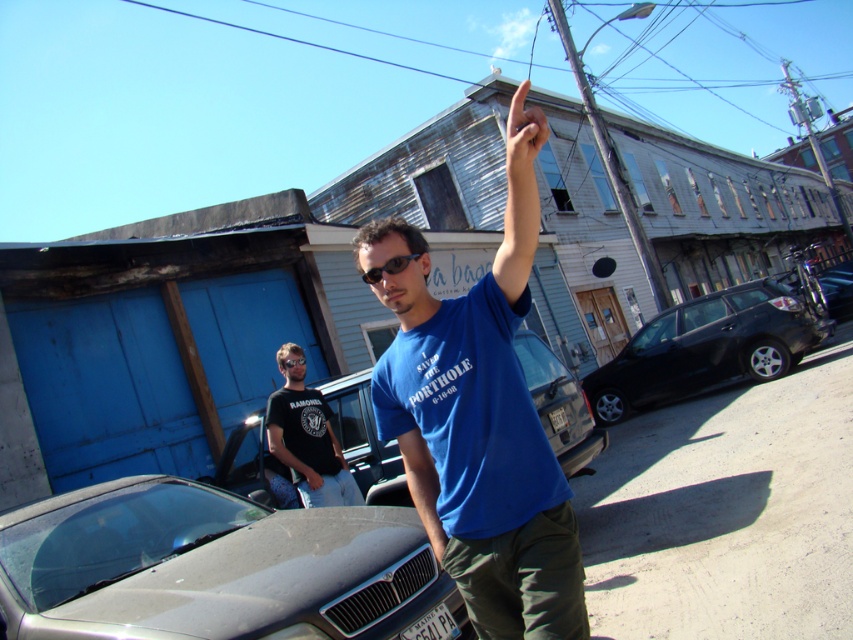
Question: Does silver metallic car at center have a greater width compared to black plastic sunglasses at center?

Choices:
 (A) no
 (B) yes

Answer: (B)

Question: Is metallic blue sedan at center to the left of matte skin hand at upper center from the viewer's perspective?

Choices:
 (A) yes
 (B) no

Answer: (A)

Question: Among these objects, which one is nearest to the camera?

Choices:
 (A) black cotton t-shirt at center
 (B) blue cotton shirt at center
 (C) black rubber goggles at center
 (D) metallic blue sedan at center

Answer: (B)

Question: In this image, where is silver metallic car at center located relative to blue cotton shirt at center?

Choices:
 (A) below
 (B) above

Answer: (A)

Question: Which of these objects is positioned farthest from the black rubber goggles at center?

Choices:
 (A) black plastic sunglasses at center
 (B) black matte car at right
 (C) silver metallic car at center

Answer: (B)

Question: Which object appears farthest from the camera in this image?

Choices:
 (A) blue cotton shirt at center
 (B) black matte car at right
 (C) silver metallic car at center

Answer: (B)